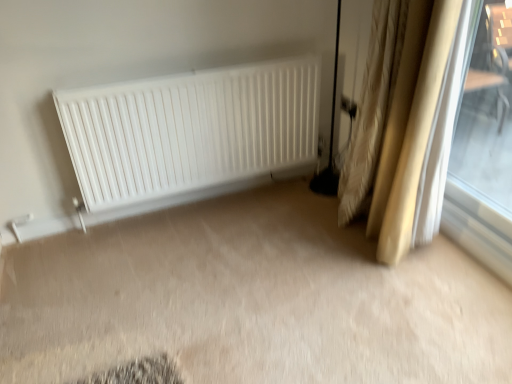
This screenshot has height=384, width=512. Identify the location of beige textured curtains at right. (415, 123).

This screenshot has height=384, width=512. Find the location of `white matte radiator at center`. white matte radiator at center is located at coordinates tap(190, 130).

Identify the location of beige textured curtains at right. Image resolution: width=512 pixels, height=384 pixels. (415, 123).

From a real-world perspective, is beige textured curtains at right beneath white matte radiator at center?

No.

Does beige textured curtains at right have a lesser height compared to white matte radiator at center?

No, beige textured curtains at right is not shorter than white matte radiator at center.

Looking at their sizes, would you say beige textured curtains at right is wider or thinner than white matte radiator at center?

beige textured curtains at right is wider than white matte radiator at center.

Considering the sizes of beige textured curtains at right and white matte radiator at center in the image, is beige textured curtains at right bigger or smaller than white matte radiator at center?

Clearly, beige textured curtains at right is larger in size than white matte radiator at center.

Considering the relative sizes of transparent glass window at right and white matte radiator at center in the image provided, is transparent glass window at right smaller than white matte radiator at center?

Yes, transparent glass window at right is smaller than white matte radiator at center.

Is transparent glass window at right thinner than white matte radiator at center?

Yes, transparent glass window at right is thinner than white matte radiator at center.

Does point (503, 140) lie behind point (185, 77)?

Yes.

Is white matte radiator at center placed right next to beige textured curtains at right?

No, white matte radiator at center is not in contact with beige textured curtains at right.

Looking at this image, does white matte radiator at center turn towards beige textured curtains at right?

Yes, white matte radiator at center is facing beige textured curtains at right.

Do you think white matte radiator at center is within beige textured curtains at right, or outside of it?

The correct answer is: outside.

From a real-world perspective, is transparent glass window at right below beige textured curtains at right?

Incorrect, from a real-world perspective, transparent glass window at right is higher than beige textured curtains at right.

From the image's perspective, is transparent glass window at right located beneath beige textured curtains at right?

Yes, from the image's perspective, transparent glass window at right is below beige textured curtains at right.

Considering their positions, is transparent glass window at right located in front of or behind beige textured curtains at right?

transparent glass window at right is in front of beige textured curtains at right.

Where is `window below the beige textured curtains at right (from the image's perspective)`? window below the beige textured curtains at right (from the image's perspective) is located at coordinates (487, 111).

Measure the distance from beige textured curtains at right to transparent glass window at right.

beige textured curtains at right is 4.33 feet away from transparent glass window at right.

Which object is further away from the camera, beige textured curtains at right or transparent glass window at right?

beige textured curtains at right.

What's the angular difference between beige textured curtains at right and transparent glass window at right's facing directions?

The angle between the facing direction of beige textured curtains at right and the facing direction of transparent glass window at right is 1.37 degrees.

Is beige textured curtains at right positioned with its back to transparent glass window at right?

That's not correct — beige textured curtains at right is not looking away from transparent glass window at right.

From the picture: Considering the relative sizes of white matte radiator at center and transparent glass window at right in the image provided, is white matte radiator at center thinner than transparent glass window at right?

No.

From a real-world perspective, who is located lower, white matte radiator at center or transparent glass window at right?

From a 3D spatial view, white matte radiator at center is below.

Is white matte radiator at center in contact with transparent glass window at right?

No, white matte radiator at center is not in contact with transparent glass window at right.

I want to click on radiator above the transparent glass window at right (from the image's perspective), so [190, 130].

In the image, there is a white matte radiator at center. Identify the location of curtain above it (from the image's perspective). This screenshot has height=384, width=512. (415, 123).

The height and width of the screenshot is (384, 512). Find the location of `window in front of the white matte radiator at center`. window in front of the white matte radiator at center is located at coordinates (487, 111).

Considering their positions, is white matte radiator at center positioned further to beige textured curtains at right than transparent glass window at right?

Among the two, transparent glass window at right is located further to beige textured curtains at right.

Estimate the real-world distances between objects in this image. Which object is further from transparent glass window at right, white matte radiator at center or beige textured curtains at right?

white matte radiator at center is further to transparent glass window at right.

Which object lies nearer to the anchor point beige textured curtains at right, transparent glass window at right or white matte radiator at center?

white matte radiator at center is positioned closer to the anchor beige textured curtains at right.

Looking at the image, which one is located closer to white matte radiator at center, transparent glass window at right or beige textured curtains at right?

beige textured curtains at right.

Which object lies nearer to the anchor point transparent glass window at right, beige textured curtains at right or white matte radiator at center?

beige textured curtains at right lies closer to transparent glass window at right than the other object.

Considering their positions, is beige textured curtains at right positioned further to white matte radiator at center than transparent glass window at right?

transparent glass window at right.

At what (x,y) coordinates should I click in order to perform the action: click on curtain between white matte radiator at center and transparent glass window at right from left to right. Please return your answer as a coordinate pair (x, y). The height and width of the screenshot is (384, 512). Looking at the image, I should click on (415, 123).